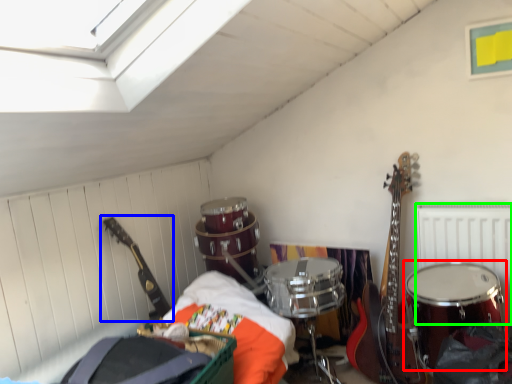
Question: Considering the real-world distances, which object is farthest from drum (highlighted by a red box)? guitar (highlighted by a blue box) or radiator (highlighted by a green box)?

Choices:
 (A) guitar
 (B) radiator

Answer: (A)